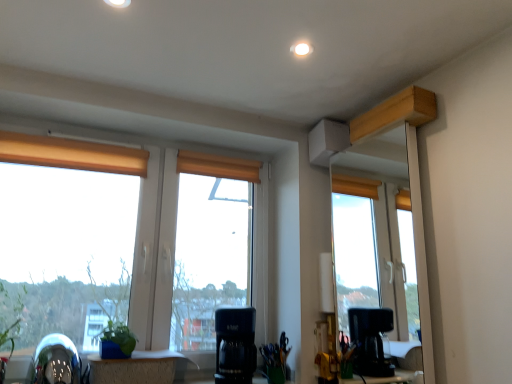
Question: Is shiny metallic swivel chair at lower left turned away from black plastic coffee maker at center?

Choices:
 (A) no
 (B) yes

Answer: (A)

Question: Can you confirm if shiny metallic swivel chair at lower left is shorter than black plastic coffee maker at center?

Choices:
 (A) no
 (B) yes

Answer: (B)

Question: Is shiny metallic swivel chair at lower left not inside black plastic coffee maker at center?

Choices:
 (A) yes
 (B) no

Answer: (A)

Question: Are shiny metallic swivel chair at lower left and black plastic coffee maker at center far apart?

Choices:
 (A) yes
 (B) no

Answer: (B)

Question: Does shiny metallic swivel chair at lower left have a larger size compared to black plastic coffee maker at center?

Choices:
 (A) yes
 (B) no

Answer: (B)

Question: Does shiny metallic swivel chair at lower left have a greater width compared to black plastic coffee maker at center?

Choices:
 (A) yes
 (B) no

Answer: (A)

Question: Does green matte plant at lower left have a larger size compared to orange fabric curtain at center, the first curtain positioned from the back?

Choices:
 (A) yes
 (B) no

Answer: (B)

Question: From a real-world perspective, does green matte plant at lower left sit lower than orange fabric curtain at center, the second curtain when ordered from left to right?

Choices:
 (A) yes
 (B) no

Answer: (A)

Question: Is green matte plant at lower left not within orange fabric curtain at center, the second curtain when ordered from left to right?

Choices:
 (A) yes
 (B) no

Answer: (A)

Question: Is green matte plant at lower left turned away from orange fabric curtain at center, the first curtain positioned from the back?

Choices:
 (A) no
 (B) yes

Answer: (A)

Question: Is green matte plant at lower left wider than orange fabric curtain at center, the first curtain positioned from the back?

Choices:
 (A) yes
 (B) no

Answer: (A)

Question: Is green matte plant at lower left thinner than orange fabric curtain at center, the second curtain when ordered from left to right?

Choices:
 (A) no
 (B) yes

Answer: (A)

Question: Considering the relative sizes of wooden table at lower center and shiny metallic swivel chair at lower left in the image provided, is wooden table at lower center wider than shiny metallic swivel chair at lower left?

Choices:
 (A) yes
 (B) no

Answer: (B)